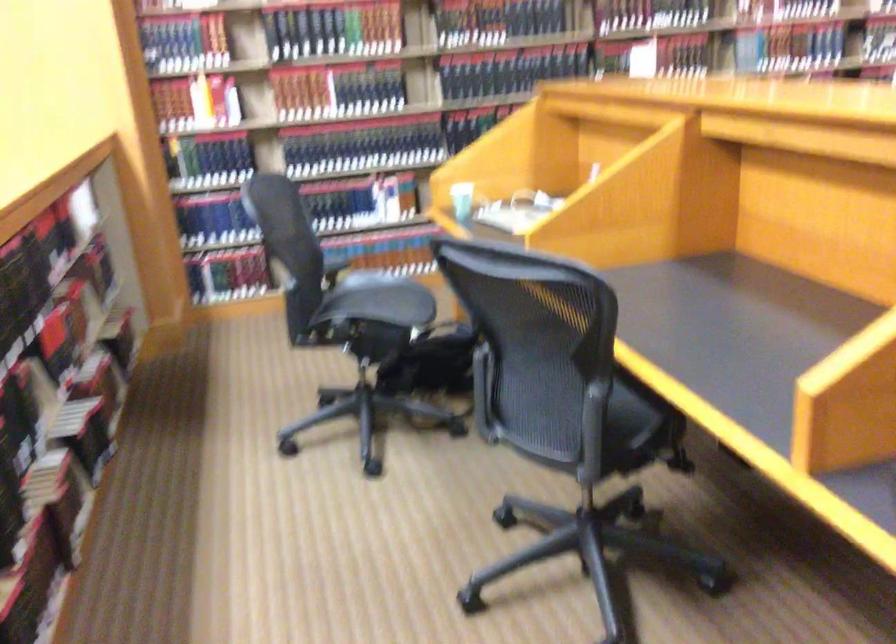
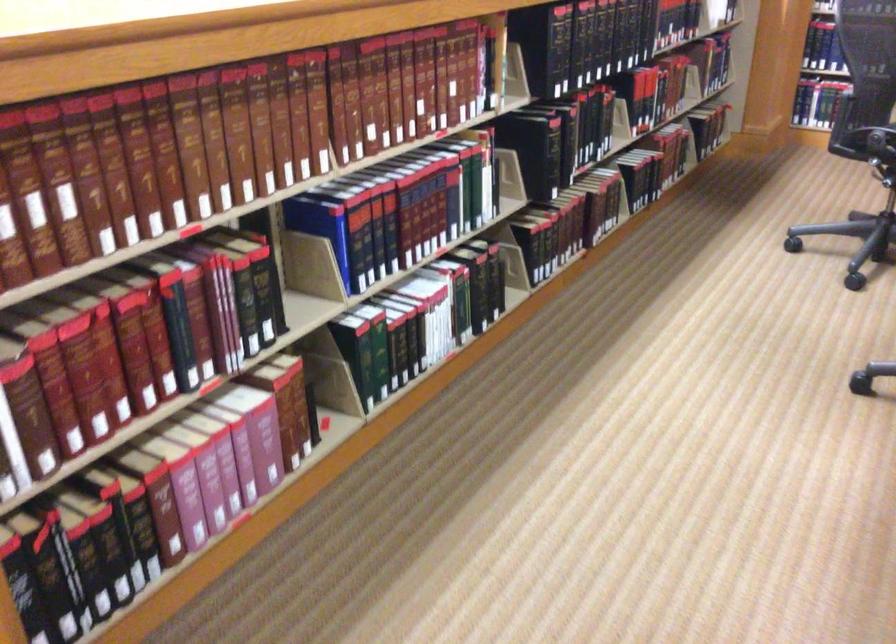
Locate, in the second image, the point that corresponds to point (201, 243) in the first image.

(833, 51)